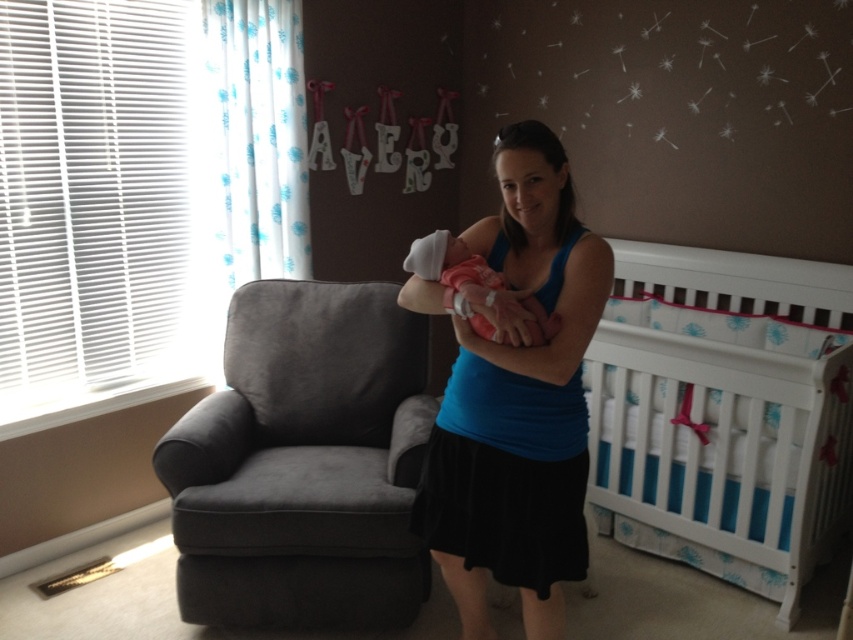
In the nursery scene, you notice the woman wearing a blue fabric tank top at center and holding a pink fabric newborn at center. Which clothing item is taller in height?

The blue fabric tank top at center is much taller than the pink fabric newborn at center.

Consider the image. You are a photographer setting up a shoot in the nursery. You need to ensure that the blue fabric tank top at center does not cover the pink fabric newborn at center in the photo. Based on their positions, is this possible?

Yes, the blue fabric tank top at center is below the pink fabric newborn at center, so adjusting the camera angle upwards would keep the newborn visible without obstruction.